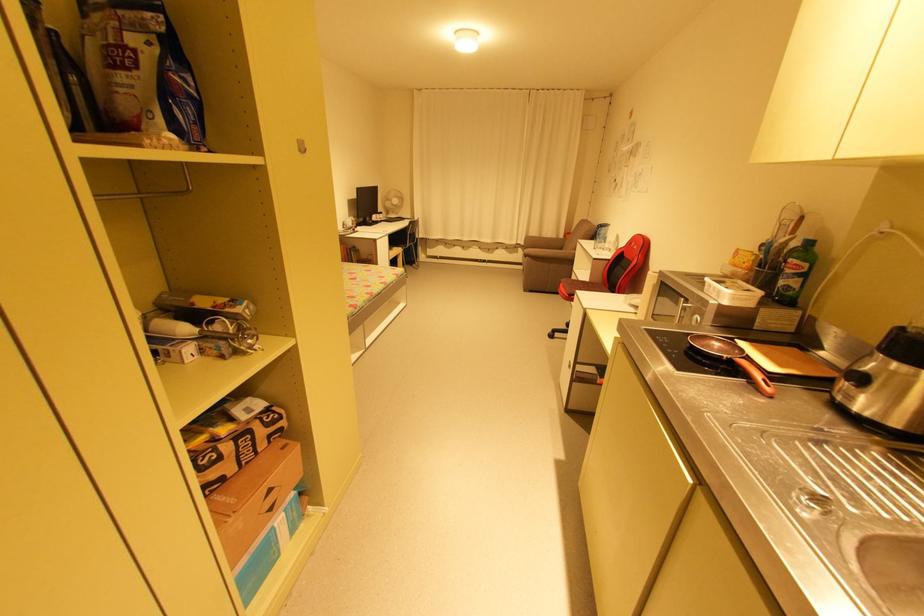
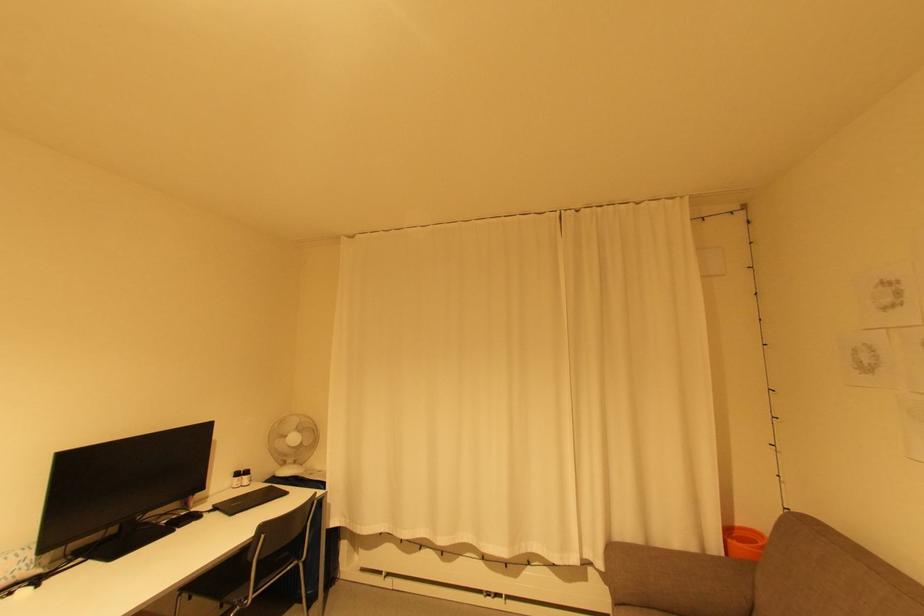
In the second image, find the point that corresponds to point (502, 249) in the first image.

(533, 564)